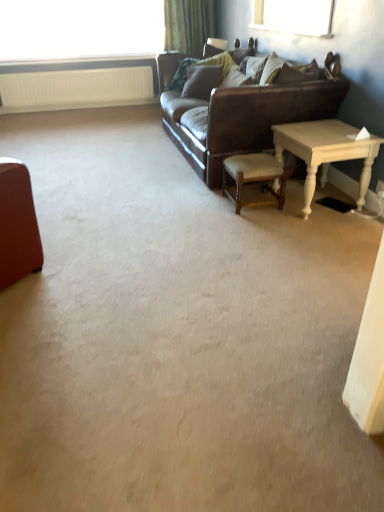
Question: From the image's perspective, is white painted wood table at right located above white textured radiator at upper left?

Choices:
 (A) yes
 (B) no

Answer: (B)

Question: Can you confirm if white painted wood table at right is positioned to the left of white textured radiator at upper left?

Choices:
 (A) yes
 (B) no

Answer: (B)

Question: Is white painted wood table at right not within white textured radiator at upper left?

Choices:
 (A) yes
 (B) no

Answer: (A)

Question: Is white painted wood table at right thinner than white textured radiator at upper left?

Choices:
 (A) yes
 (B) no

Answer: (B)

Question: Could you tell me if white painted wood table at right is facing white textured radiator at upper left?

Choices:
 (A) no
 (B) yes

Answer: (A)

Question: Would you consider white painted wood table at right to be distant from white textured radiator at upper left?

Choices:
 (A) yes
 (B) no

Answer: (A)

Question: Does transparent glass window at upper left appear on the left side of white painted wood table at right?

Choices:
 (A) no
 (B) yes

Answer: (B)

Question: Is white painted wood table at right at the back of transparent glass window at upper left?

Choices:
 (A) no
 (B) yes

Answer: (A)

Question: Is transparent glass window at upper left positioned in front of white painted wood table at right?

Choices:
 (A) yes
 (B) no

Answer: (B)

Question: From a real-world perspective, is transparent glass window at upper left located higher than white painted wood table at right?

Choices:
 (A) yes
 (B) no

Answer: (A)

Question: Can you confirm if transparent glass window at upper left is taller than white painted wood table at right?

Choices:
 (A) yes
 (B) no

Answer: (A)

Question: Does transparent glass window at upper left appear on the right side of white painted wood table at right?

Choices:
 (A) no
 (B) yes

Answer: (A)

Question: From the image's perspective, would you say white textured radiator at upper left is positioned over wooden chair at center?

Choices:
 (A) no
 (B) yes

Answer: (B)